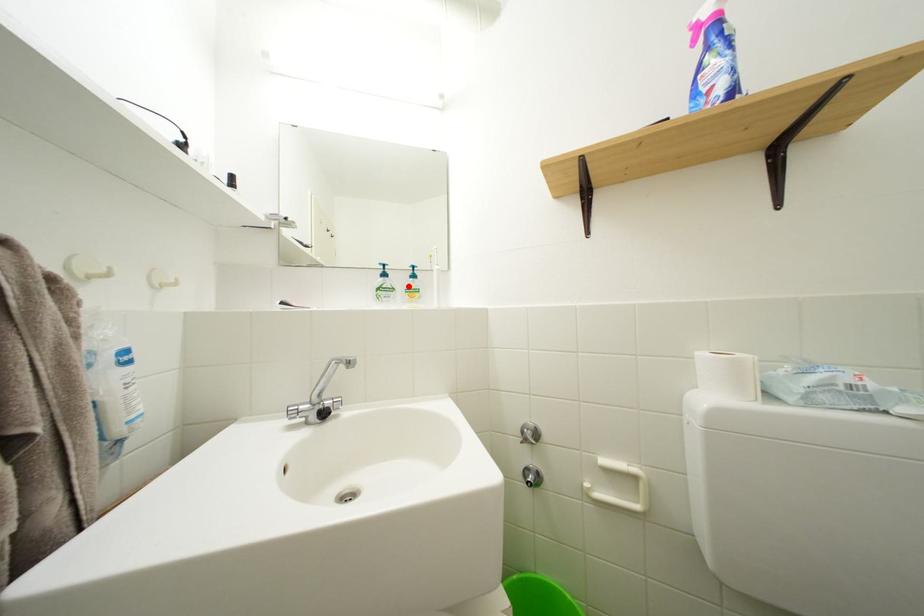
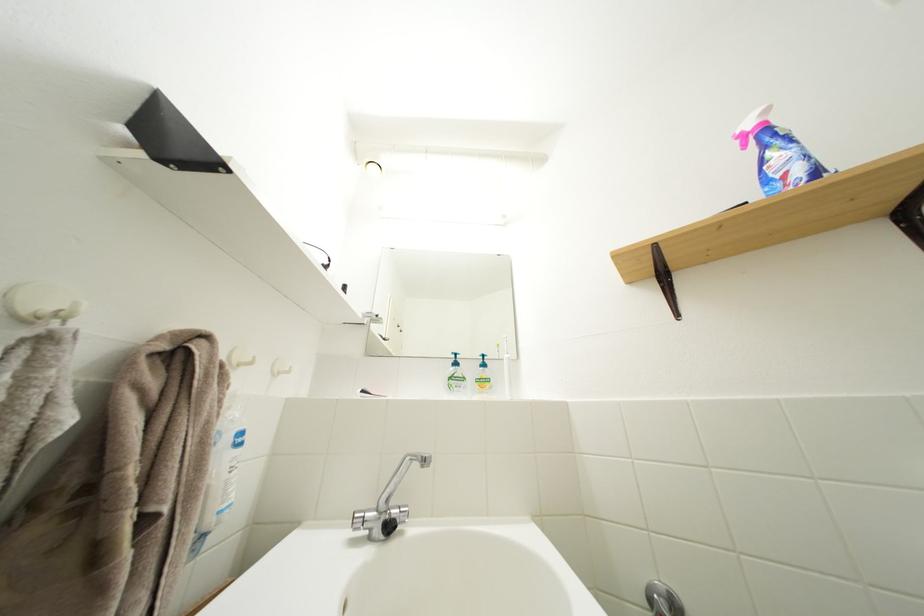
Where in the second image is the point corresponding to the highlighted location from the first image?

(479, 376)